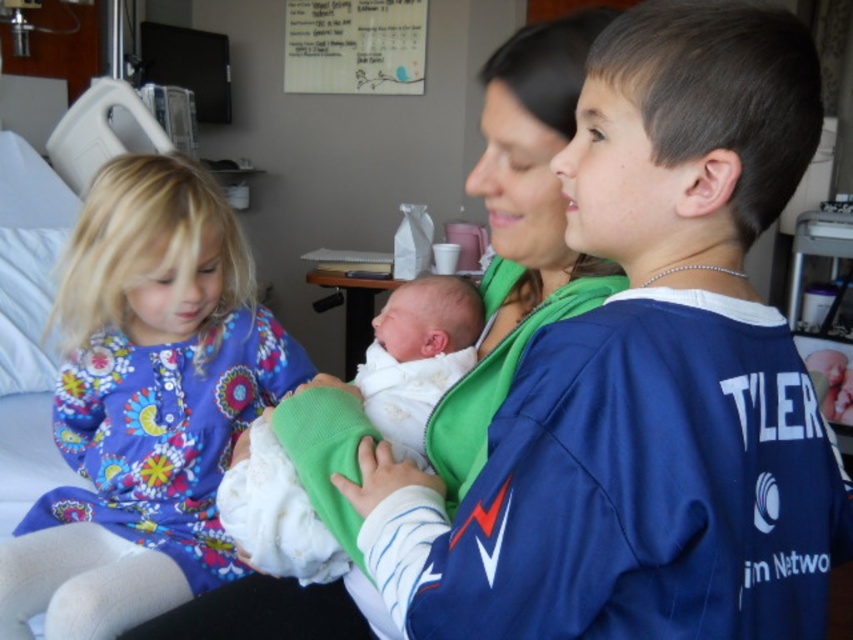
Based on the photo, can you confirm if floral fabric dress at left is smaller than white soft fabric newborn at center?

Incorrect, floral fabric dress at left is not smaller in size than white soft fabric newborn at center.

In the scene shown: Who is more distant from viewer, [169,394] or [422,346]?

The point [169,394] is more distant.

Is point (173, 452) less distant than point (442, 307)?

No, (173, 452) is further to viewer.

Identify the location of floral fabric dress at left. (144, 403).

Which is behind, point (293, 577) or point (376, 404)?

The point (293, 577) is more distant.

Is white soft swaddled newborn at center closer to the viewer compared to white soft fabric newborn at center?

That is True.

Is point (376, 422) farther from camera compared to point (457, 344)?

That is False.

In order to click on white soft swaddled newborn at center in this screenshot , I will do pos(416,355).

Who is positioned more to the right, floral fabric dress at left or white soft swaddled newborn at center?

white soft swaddled newborn at center

Is floral fabric dress at left smaller than white soft swaddled newborn at center?

Actually, floral fabric dress at left might be larger than white soft swaddled newborn at center.

Find the location of `floral fabric dress at left`. floral fabric dress at left is located at coordinates (144, 403).